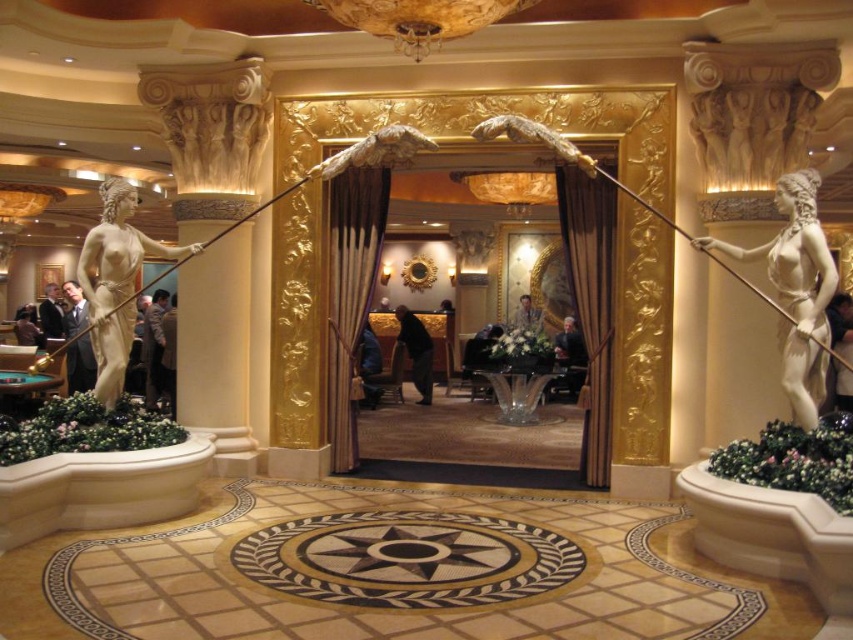
Is white marble statue at right to the right of matte gold statue at left from the viewer's perspective?

Correct, you'll find white marble statue at right to the right of matte gold statue at left.

Can you confirm if white marble statue at right is taller than matte gold statue at left?

Yes.

Which is behind, point (786, 308) or point (131, 205)?

Positioned behind is point (131, 205).

I want to click on white marble statue at right, so click(796, 291).